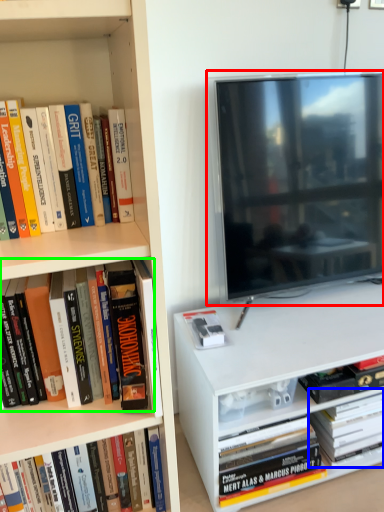
Question: Which is farther away from television (highlighted by a red box)? book (highlighted by a blue box) or book (highlighted by a green box)?

Choices:
 (A) book
 (B) book

Answer: (B)